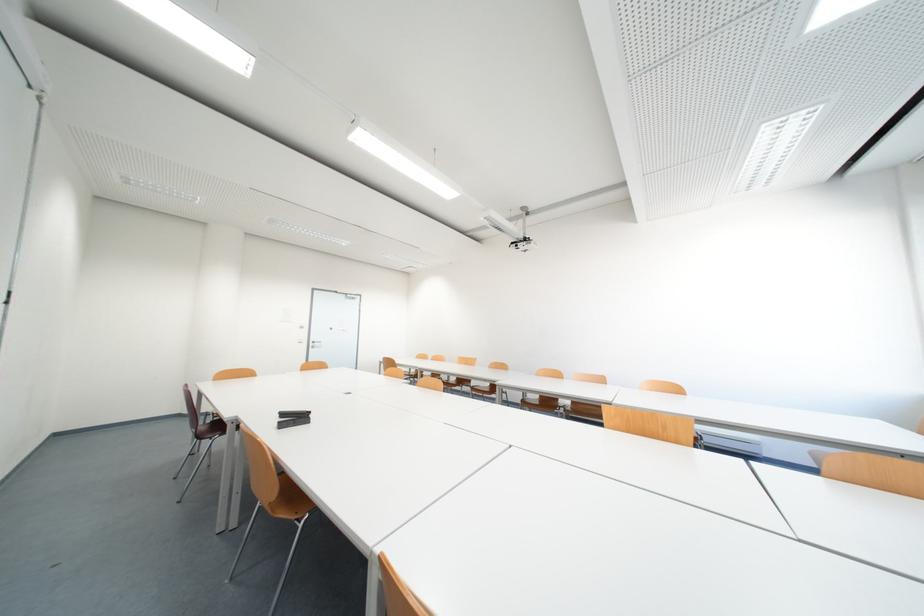
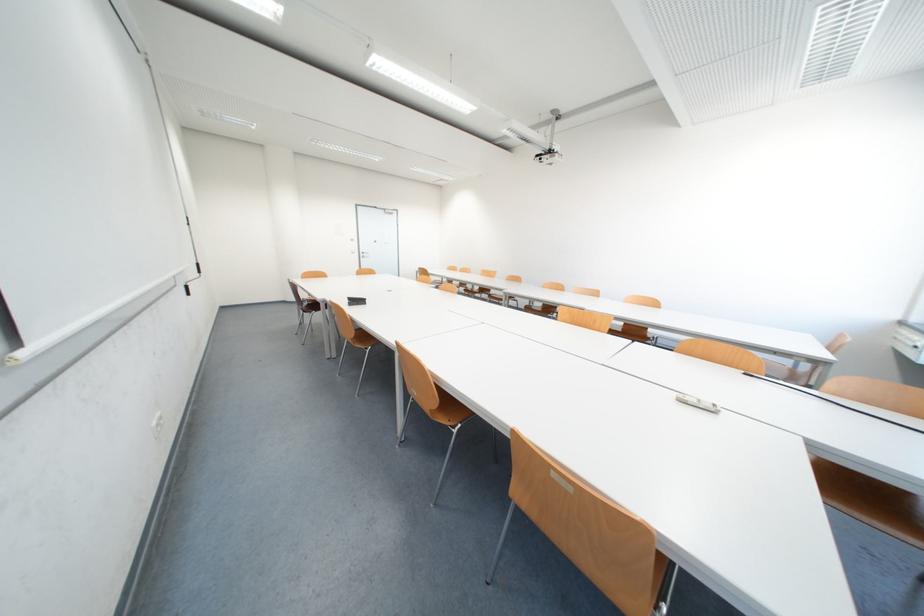
Find the pixel in the second image that matches point 277,495 in the first image.

(359, 336)